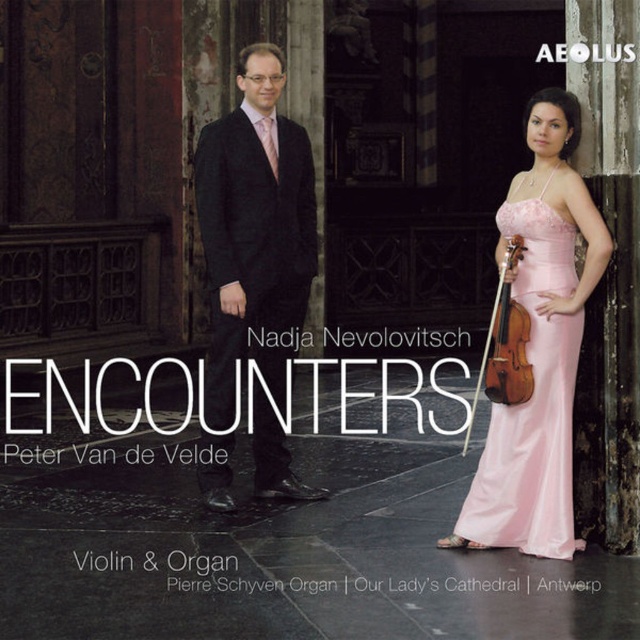
You are attending a classical music concert in the grand cathedral setting shown. You notice two performers on stage. One is wearing a black wool suit at center and the other a pink satin dress at right. From your seat in the audience, which performer is positioned higher in elevation?

The black wool suit at center is located above the pink satin dress at right, so the performer in the black wool suit at center is positioned higher in elevation.